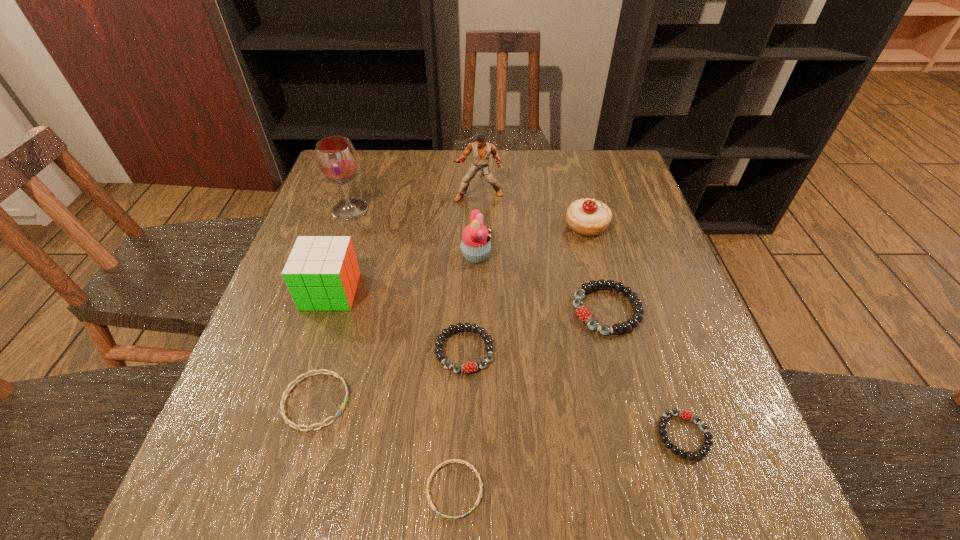
This screenshot has height=540, width=960. Find the location of `free location that satisfies the following two spatial constraints: 1. on the front side of the wineglass; 2. on the right side of the cube`. free location that satisfies the following two spatial constraints: 1. on the front side of the wineglass; 2. on the right side of the cube is located at coordinates (323, 292).

This screenshot has height=540, width=960. What are the coordinates of `vacant space that satisfies the following two spatial constraints: 1. on the front-facing side of the puncher; 2. on the face of the fourth farthest object` in the screenshot? It's located at (478, 256).

At what (x,y) coordinates should I click in order to perform the action: click on vacant space that satisfies the following two spatial constraints: 1. on the front side of the cube; 2. on the right side of the nearest black bracelet. Please return your answer as a coordinate pair (x, y). Looking at the image, I should click on (285, 435).